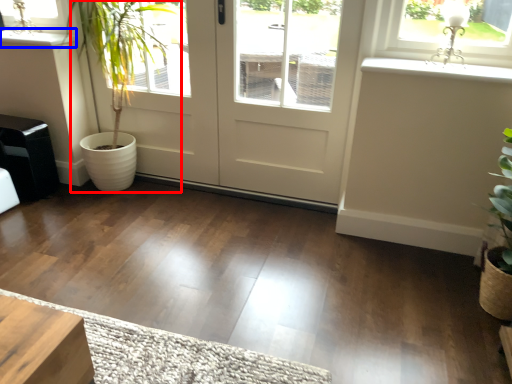
Question: Which of the following is the closest to the observer, houseplant (highlighted by a red box) or window sill (highlighted by a blue box)?

Choices:
 (A) houseplant
 (B) window sill

Answer: (A)